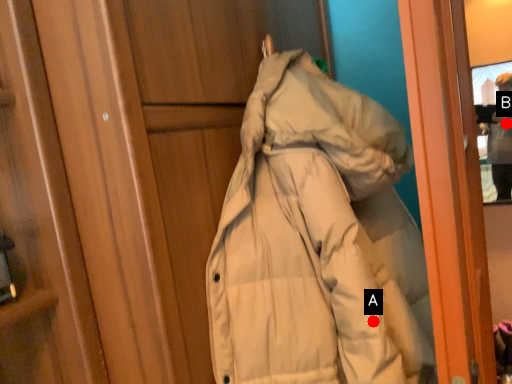
Question: Two points are circled on the image, labeled by A and B beside each circle. Which point is further to the camera?

Choices:
 (A) A is further
 (B) B is further

Answer: (B)